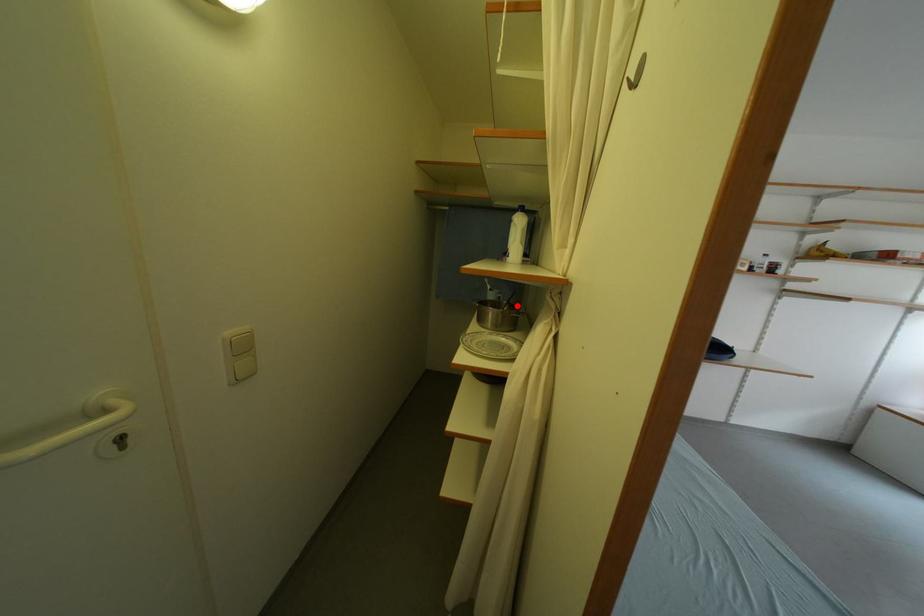
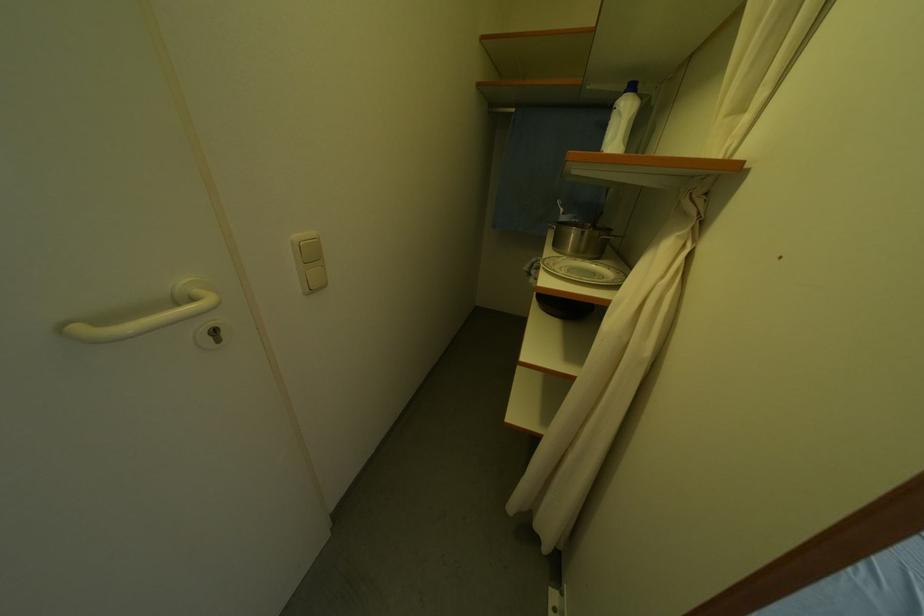
Where in the second image is the point corresponding to the highlighted location from the first image?

(602, 228)